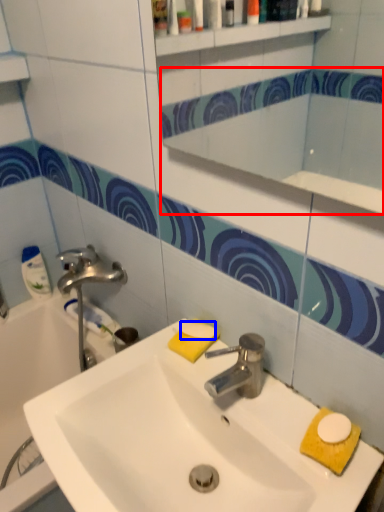
Question: Which point is further to the camera, mirror (highlighted by a red box) or soap (highlighted by a blue box)?

Choices:
 (A) mirror
 (B) soap

Answer: (B)